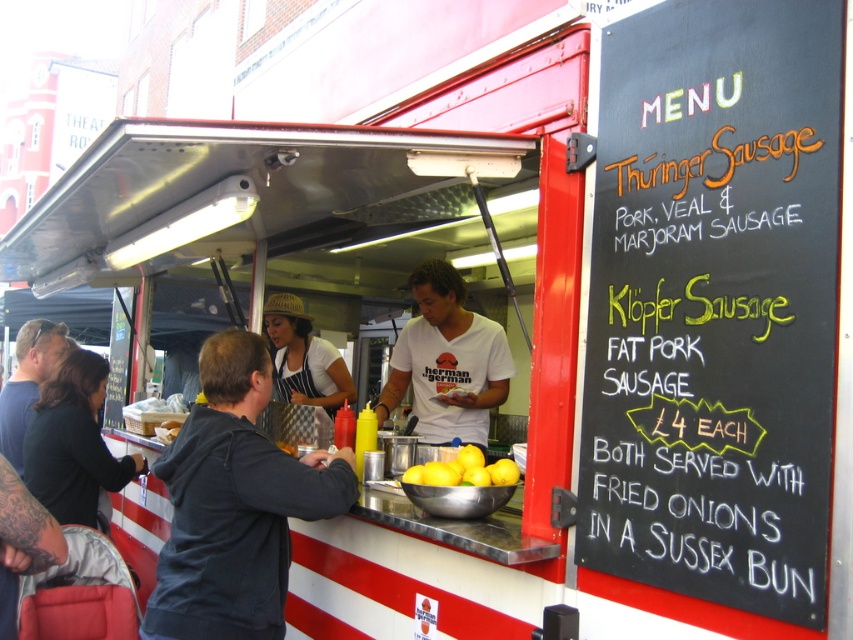
Question: Which point is farther from the camera taking this photo?

Choices:
 (A) (242, 531)
 (B) (445, 468)
 (C) (723, 365)
 (D) (51, 454)

Answer: (D)

Question: Can you confirm if black chalkboard menu at right is bigger than yellow matte lemons at center?

Choices:
 (A) no
 (B) yes

Answer: (B)

Question: Is white cotton shirt at center positioned behind dark brown leather jacket at lower left?

Choices:
 (A) no
 (B) yes

Answer: (A)

Question: Is dark gray hoodie at center further to the viewer compared to white cotton shirt at center?

Choices:
 (A) yes
 (B) no

Answer: (B)

Question: Which object is closer to the camera taking this photo?

Choices:
 (A) white cotton shirt at center
 (B) yellow matte lemons at center
 (C) black chalkboard menu at right

Answer: (C)

Question: Which point appears farthest from the camera in this image?

Choices:
 (A) (763, 250)
 (B) (61, 403)

Answer: (B)